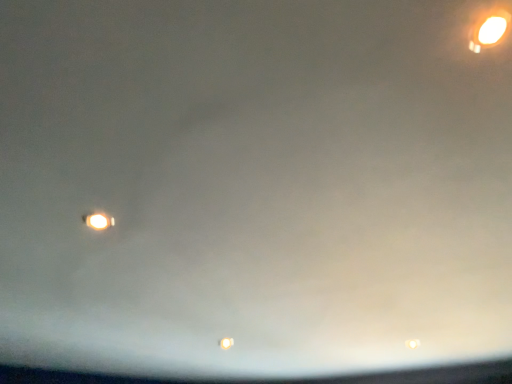
Question: Considering the relative positions of matte yellow street light at lower left, acting as the 2th street light starting from the front, and matte yellow street light at upper right, the second street light from the bottom, in the image provided, is matte yellow street light at lower left, acting as the 2th street light starting from the front, to the left or to the right of matte yellow street light at upper right, the second street light from the bottom,?

Choices:
 (A) right
 (B) left

Answer: (B)

Question: Is matte yellow street light at lower left, which is counted as the 1th street light, starting from the left, inside the boundaries of matte yellow street light at upper right, the 1th street light viewed from the right, or outside?

Choices:
 (A) inside
 (B) outside

Answer: (B)

Question: Based on their sizes in the image, would you say matte yellow street light at lower left, which is counted as the 1th street light, starting from the left, is bigger or smaller than matte yellow street light at upper right, which is the 1th street light in top-to-bottom order?

Choices:
 (A) small
 (B) big

Answer: (A)

Question: Is matte yellow street light at upper right, which is the 2th street light in left-to-right order, inside the boundaries of matte yellow street light at lower left, which is the second street light from right to left, or outside?

Choices:
 (A) outside
 (B) inside

Answer: (A)

Question: Based on their positions, is matte yellow street light at upper right, which is the 1th street light in front-to-back order, located to the left or right of matte yellow street light at lower left, the first street light positioned from the back?

Choices:
 (A) left
 (B) right

Answer: (B)

Question: From a real-world perspective, is matte yellow street light at upper right, which is the 2th street light in left-to-right order, above or below matte yellow street light at lower left, placed as the first street light when sorted from bottom to top?

Choices:
 (A) above
 (B) below

Answer: (A)

Question: Looking at their shapes, would you say matte yellow street light at upper right, which is the 2th street light in left-to-right order, is wider or thinner than matte yellow street light at lower left, which is the second street light from right to left?

Choices:
 (A) wide
 (B) thin

Answer: (B)